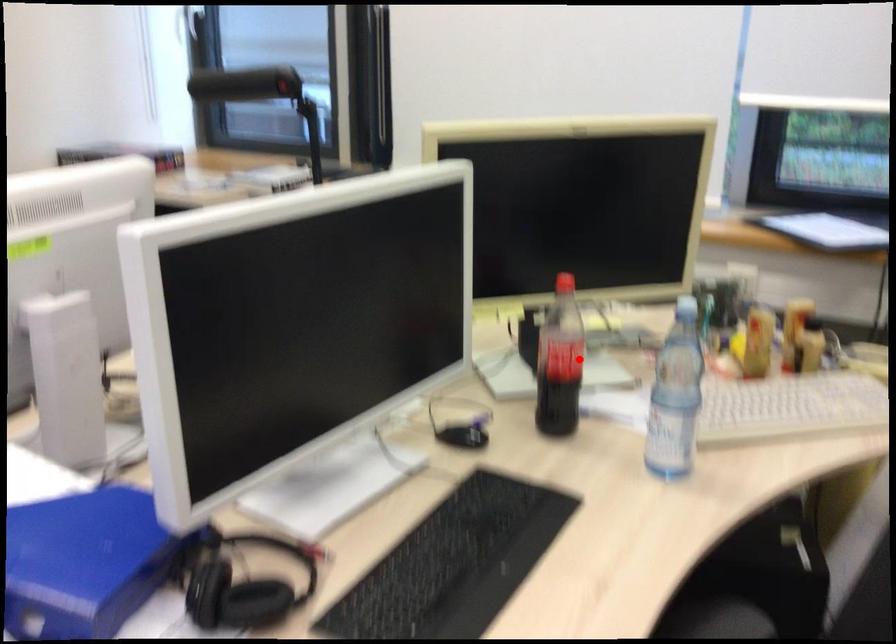
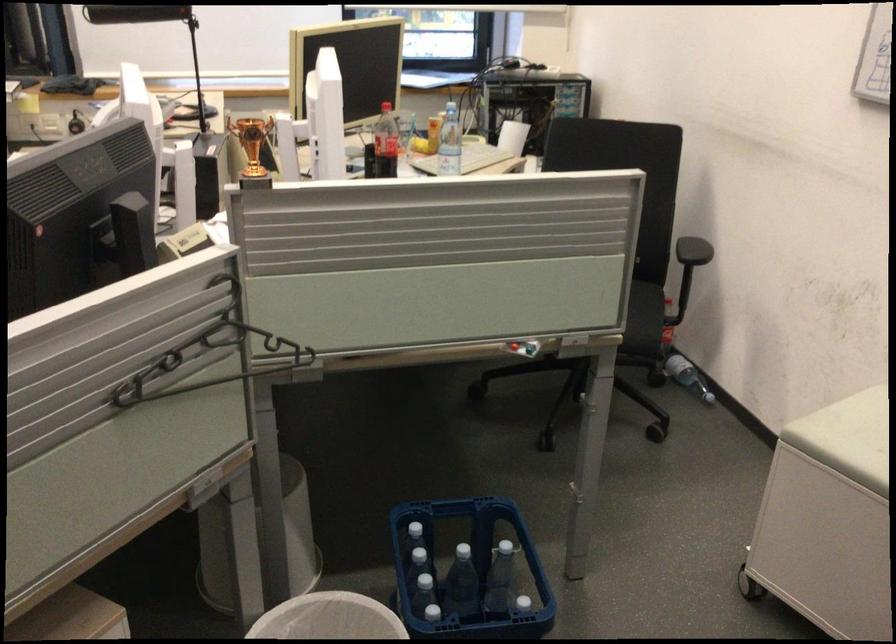
Question: A red point is marked in image1. In image2, is the corresponding 3D point closer to the camera or farther? Reply with the corresponding letter.

Choices:
 (A) The corresponding 3D point is closer.
 (B) The corresponding 3D point is farther.

Answer: (B)